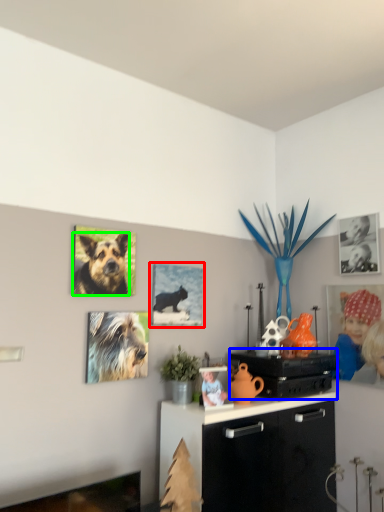
Question: Which is farther away from picture frame (highlighted by a red box)? appliance (highlighted by a blue box) or dog (highlighted by a green box)?

Choices:
 (A) appliance
 (B) dog

Answer: (A)